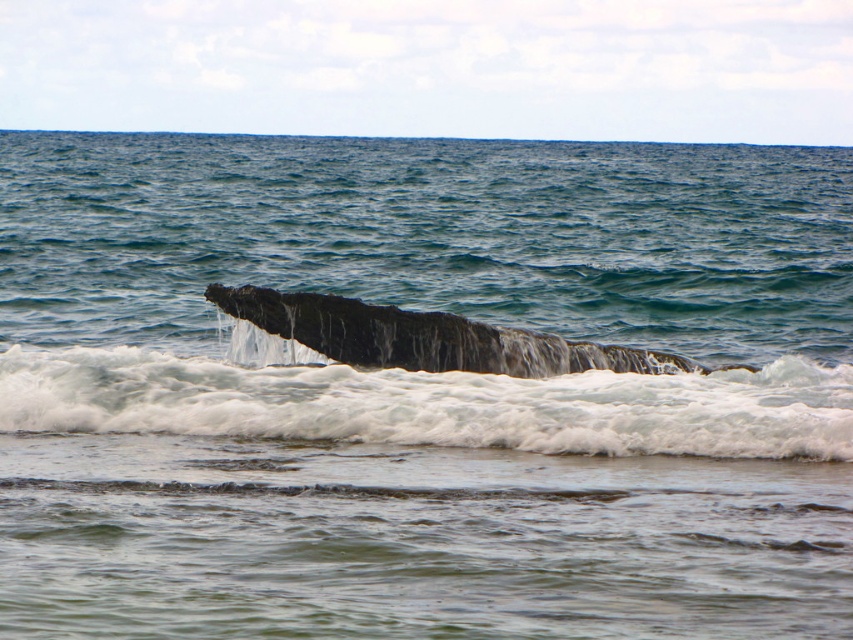
Question: Can you confirm if dark gray textured rock at center is thinner than dark gray textured whale at center?

Choices:
 (A) yes
 (B) no

Answer: (B)

Question: From the image, what is the correct spatial relationship of dark gray textured rock at center in relation to dark gray textured whale at center?

Choices:
 (A) below
 (B) above

Answer: (A)

Question: Which point appears closest to the camera in this image?

Choices:
 (A) (413, 412)
 (B) (607, 353)

Answer: (A)

Question: Which object is closer to the camera taking this photo?

Choices:
 (A) dark gray textured whale at center
 (B) dark gray textured rock at center

Answer: (B)

Question: Is dark gray textured rock at center positioned in front of dark gray textured whale at center?

Choices:
 (A) no
 (B) yes

Answer: (B)

Question: Which object appears closest to the camera in this image?

Choices:
 (A) dark gray textured rock at center
 (B) dark gray textured whale at center

Answer: (A)